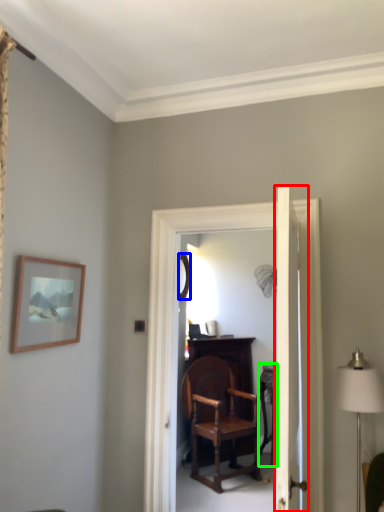
Question: Based on their relative distances, which object is nearer to door (highlighted by a red box)? Choose from mirror (highlighted by a blue box) and table (highlighted by a green box).

Choices:
 (A) mirror
 (B) table

Answer: (B)